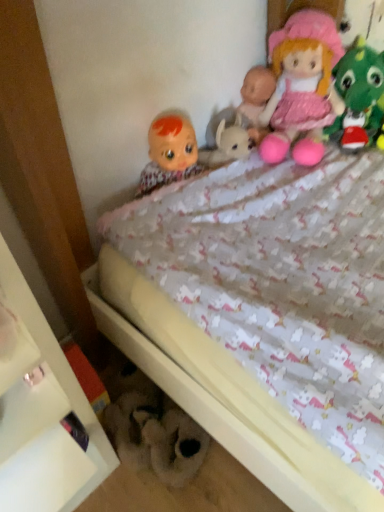
Question: From the image's perspective, is matte plastic doll at upper left, the 2th doll viewed from the right, located above or below pink fabric doll at upper right, which is counted as the 1th doll, starting from the right?

Choices:
 (A) above
 (B) below

Answer: (B)

Question: From their relative heights in the image, would you say matte plastic doll at upper left, the first doll in the left-to-right sequence, is taller or shorter than pink fabric doll at upper right, placed as the second doll when sorted from left to right?

Choices:
 (A) tall
 (B) short

Answer: (B)

Question: Which object is the farthest from the matte plastic doll at upper left, the 2th doll viewed from the right?

Choices:
 (A) pink fabric doll at upper right, which is counted as the 1th doll, starting from the right
 (B) white glossy shelf at lower left
 (C) fluffy white teddy bear at lower center, the second toy positioned from the top
 (D) pink fabric doll at upper right, which is counted as the 1th toy, starting from the right

Answer: (C)

Question: Estimate the real-world distances between objects in this image. Which object is farther from the fluffy white teddy bear at lower center, the 2th toy from the right?

Choices:
 (A) matte plastic doll at upper left, the 2th doll viewed from the right
 (B) pink fabric doll at upper right, placed as the second doll when sorted from left to right
 (C) pink fabric doll at upper right, which appears as the second toy when viewed from the left
 (D) white glossy shelf at lower left

Answer: (C)